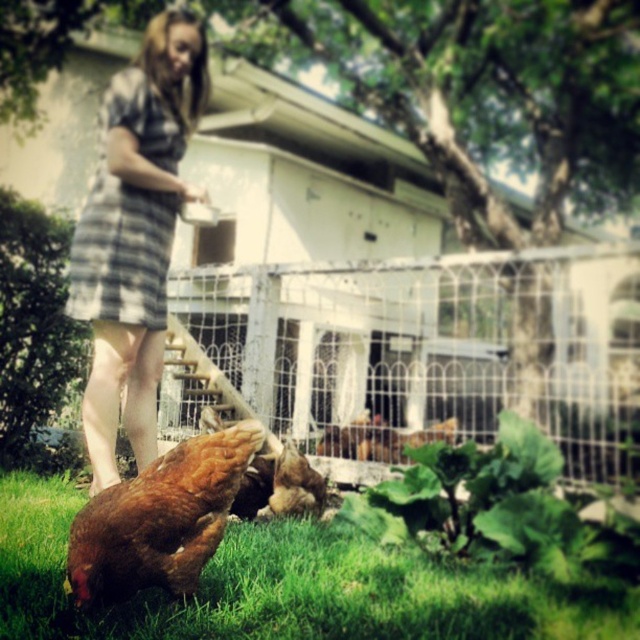
Can you confirm if green grass at lower left is thinner than brown feathered chicken at center?

Incorrect, green grass at lower left's width is not less than brown feathered chicken at center's.

Who is more forward, [561,630] or [308,481]?

Point [561,630]

At what (x,y) coordinates should I click in order to perform the action: click on green grass at lower left. Please return your answer as a coordinate pair (x, y). Looking at the image, I should click on (289, 586).

Is green grass at lower left below brown feathered chicken at lower left?

Indeed, green grass at lower left is positioned under brown feathered chicken at lower left.

Which is below, green grass at lower left or brown feathered chicken at lower left?

green grass at lower left is lower down.

Is point (332, 596) farther from viewer compared to point (129, 506)?

Yes, point (332, 596) is behind point (129, 506).

What are the coordinates of `green grass at lower left` in the screenshot? It's located at (289, 586).

Is wire mesh fence at center thinner than brown feathered chicken at center?

Incorrect, wire mesh fence at center's width is not less than brown feathered chicken at center's.

Which is behind, point (634, 316) or point (282, 506)?

Point (634, 316)

Find the location of a particular element. wire mesh fence at center is located at coordinates (429, 346).